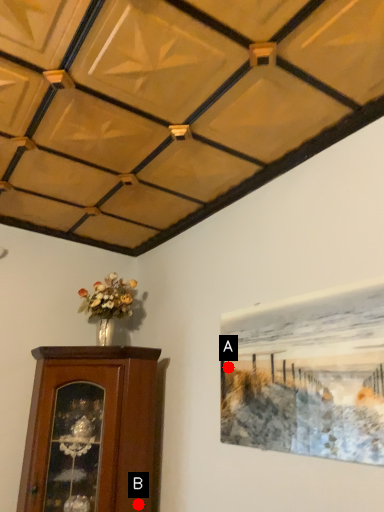
Question: Two points are circled on the image, labeled by A and B beside each circle. Which point is closer to the camera?

Choices:
 (A) A is closer
 (B) B is closer

Answer: (A)